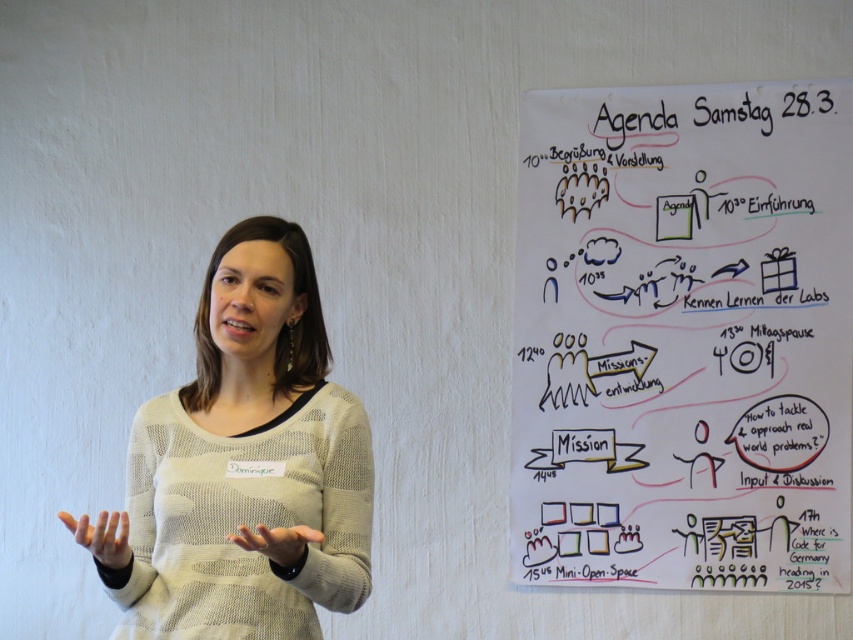
Is matte skin hand at center wider than smooth beige sweater at center?

In fact, matte skin hand at center might be narrower than smooth beige sweater at center.

Identify the location of matte skin hand at center. The width and height of the screenshot is (853, 640). (102, 536).

Is point (640, 376) less distant than point (84, 532)?

No, it is behind (84, 532).

Which is below, white paper at upper right or matte skin hand at center?

Positioned lower is matte skin hand at center.

From the picture: Who is more distant from viewer, (x=675, y=570) or (x=103, y=532)?

The point (x=675, y=570) is behind.

Where is `white paper at upper right`? The image size is (853, 640). white paper at upper right is located at coordinates (683, 337).

Who is positioned more to the left, knit sweater at left or smooth beige sweater at center?

knit sweater at left is more to the left.

Does knit sweater at left appear over smooth beige sweater at center?

Indeed, knit sweater at left is positioned over smooth beige sweater at center.

Find the location of a particular element. The height and width of the screenshot is (640, 853). knit sweater at left is located at coordinates (247, 461).